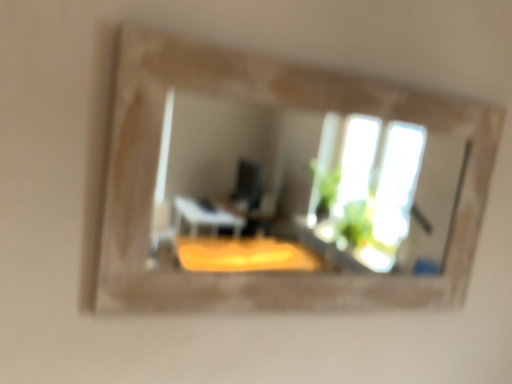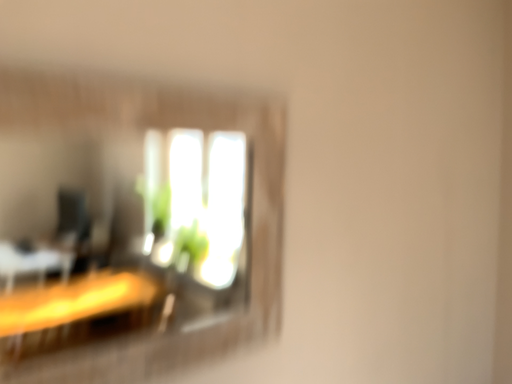
Question: Which way did the camera rotate in the video?

Choices:
 (A) rotated right
 (B) rotated left

Answer: (A)